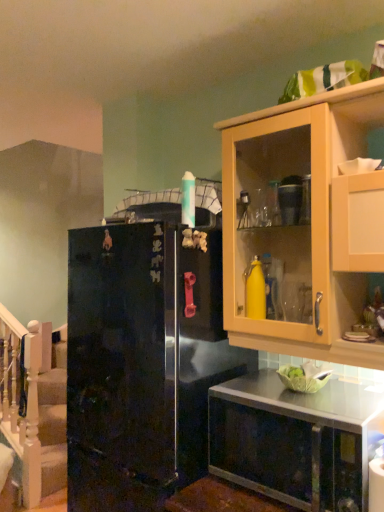
What is the approximate width of metallic stainless steel microwave at lower right?

The width of metallic stainless steel microwave at lower right is 16.71 inches.

What do you see at coordinates (142, 362) in the screenshot?
I see `glossy black refrigerator at left` at bounding box center [142, 362].

Where is `glossy black refrigerator at left`? The width and height of the screenshot is (384, 512). glossy black refrigerator at left is located at coordinates (142, 362).

Where is `light wood cabinet at upper right`? light wood cabinet at upper right is located at coordinates (302, 226).

Where is `metallic stainless steel microwave at lower right`? This screenshot has width=384, height=512. metallic stainless steel microwave at lower right is located at coordinates (293, 440).

From the image's perspective, who appears lower, light wood cabinet at upper right or metallic stainless steel microwave at lower right?

metallic stainless steel microwave at lower right.

Does light wood cabinet at upper right appear on the right side of metallic stainless steel microwave at lower right?

Yes, light wood cabinet at upper right is to the right of metallic stainless steel microwave at lower right.

Between light wood cabinet at upper right and metallic stainless steel microwave at lower right, which one has larger size?

light wood cabinet at upper right is bigger.

In terms of height, does light wood cabinet at upper right look taller or shorter compared to metallic stainless steel microwave at lower right?

Considering their sizes, light wood cabinet at upper right has more height than metallic stainless steel microwave at lower right.

Is there a large distance between metallic stainless steel microwave at lower right and light wood cabinet at upper right?

No, metallic stainless steel microwave at lower right is in close proximity to light wood cabinet at upper right.

From the image's perspective, which one is positioned lower, metallic stainless steel microwave at lower right or light wood cabinet at upper right?

From the image's view, metallic stainless steel microwave at lower right is below.

Looking at this image, which is more to the right, metallic stainless steel microwave at lower right or light wood cabinet at upper right?

light wood cabinet at upper right.

In the scene shown: Is metallic stainless steel microwave at lower right wider than glossy black refrigerator at left?

No.

Considering the relative positions of metallic stainless steel microwave at lower right and glossy black refrigerator at left in the image provided, is metallic stainless steel microwave at lower right behind glossy black refrigerator at left?

No, the depth of metallic stainless steel microwave at lower right is less than that of glossy black refrigerator at left.

Does metallic stainless steel microwave at lower right appear on the left side of glossy black refrigerator at left?

In fact, metallic stainless steel microwave at lower right is to the right of glossy black refrigerator at left.

From the picture: From a real-world perspective, which is physically above, metallic stainless steel microwave at lower right or glossy black refrigerator at left?

glossy black refrigerator at left is physically above.

Is white wooden staircase at left located within metallic stainless steel microwave at lower right?

No, white wooden staircase at left is not inside metallic stainless steel microwave at lower right.

Does point (274, 430) lie in front of point (27, 379)?

Yes, point (274, 430) is in front of point (27, 379).

From a real-world perspective, who is located higher, metallic stainless steel microwave at lower right or white wooden staircase at left?

metallic stainless steel microwave at lower right.

Who is taller, metallic stainless steel microwave at lower right or white wooden staircase at left?

With more height is white wooden staircase at left.

From the picture: Is glossy black refrigerator at left completely or partially outside of light wood cabinet at upper right?

That's correct, glossy black refrigerator at left is outside of light wood cabinet at upper right.

Measure the distance from glossy black refrigerator at left to light wood cabinet at upper right.

They are 15.43 inches apart.

Is glossy black refrigerator at left oriented away from light wood cabinet at upper right?

No, light wood cabinet at upper right is not at the back of glossy black refrigerator at left.

Between glossy black refrigerator at left and light wood cabinet at upper right, which one has smaller size?

light wood cabinet at upper right is smaller.

In the scene shown: Measure the distance between white wooden staircase at left and light wood cabinet at upper right.

white wooden staircase at left is 2.30 meters from light wood cabinet at upper right.

Is white wooden staircase at left facing away from light wood cabinet at upper right?

white wooden staircase at left is not turned away from light wood cabinet at upper right.

Which is in front, white wooden staircase at left or light wood cabinet at upper right?

light wood cabinet at upper right is more forward.

Between white wooden staircase at left and light wood cabinet at upper right, which one has more height?

With more height is white wooden staircase at left.

From the image's perspective, is glossy black refrigerator at left located above metallic stainless steel microwave at lower right?

No.

Which object is further away from the camera taking this photo, glossy black refrigerator at left or metallic stainless steel microwave at lower right?

glossy black refrigerator at left is behind.

Is glossy black refrigerator at left located outside metallic stainless steel microwave at lower right?

That's correct, glossy black refrigerator at left is outside of metallic stainless steel microwave at lower right.

Does glossy black refrigerator at left have a greater width compared to metallic stainless steel microwave at lower right?

Correct, the width of glossy black refrigerator at left exceeds that of metallic stainless steel microwave at lower right.

Identify the location of cabinetry above the metallic stainless steel microwave at lower right (from a real-world perspective). This screenshot has height=512, width=384. (302, 226).

Image resolution: width=384 pixels, height=512 pixels. Identify the location of countertop below the light wood cabinet at upper right (from the image's perspective). (293, 440).

Estimate the real-world distances between objects in this image. Which object is closer to glossy black refrigerator at left, metallic stainless steel microwave at lower right or white wooden staircase at left?

Based on the image, metallic stainless steel microwave at lower right appears to be nearer to glossy black refrigerator at left.

From the image, which object appears to be nearer to glossy black refrigerator at left, light wood cabinet at upper right or metallic stainless steel microwave at lower right?

metallic stainless steel microwave at lower right is positioned closer to the anchor glossy black refrigerator at left.

Estimate the real-world distances between objects in this image. Which object is further from light wood cabinet at upper right, metallic stainless steel microwave at lower right or glossy black refrigerator at left?

Among the two, metallic stainless steel microwave at lower right is located further to light wood cabinet at upper right.

Based on their spatial positions, is white wooden staircase at left or glossy black refrigerator at left closer to metallic stainless steel microwave at lower right?

Based on the image, glossy black refrigerator at left appears to be nearer to metallic stainless steel microwave at lower right.

Which object lies nearer to the anchor point white wooden staircase at left, metallic stainless steel microwave at lower right or glossy black refrigerator at left?

glossy black refrigerator at left is positioned closer to the anchor white wooden staircase at left.

Looking at this image, considering their positions, is glossy black refrigerator at left positioned further to light wood cabinet at upper right than metallic stainless steel microwave at lower right?

Based on the image, metallic stainless steel microwave at lower right appears to be further to light wood cabinet at upper right.

Looking at the image, which one is located further to white wooden staircase at left, glossy black refrigerator at left or light wood cabinet at upper right?

Based on the image, light wood cabinet at upper right appears to be further to white wooden staircase at left.

Estimate the real-world distances between objects in this image. Which object is further from light wood cabinet at upper right, glossy black refrigerator at left or white wooden staircase at left?

white wooden staircase at left.

The image size is (384, 512). In order to click on refrigerator between light wood cabinet at upper right and white wooden staircase at left from front to back in this screenshot , I will do `click(142, 362)`.

At what (x,y) coordinates should I click in order to perform the action: click on countertop between white wooden staircase at left and light wood cabinet at upper right in the horizontal direction. Please return your answer as a coordinate pair (x, y). Image resolution: width=384 pixels, height=512 pixels. Looking at the image, I should click on (293, 440).

Identify the location of countertop that lies between light wood cabinet at upper right and glossy black refrigerator at left from top to bottom. The image size is (384, 512). (293, 440).

Image resolution: width=384 pixels, height=512 pixels. Identify the location of refrigerator between metallic stainless steel microwave at lower right and white wooden staircase at left in the front-back direction. (142, 362).